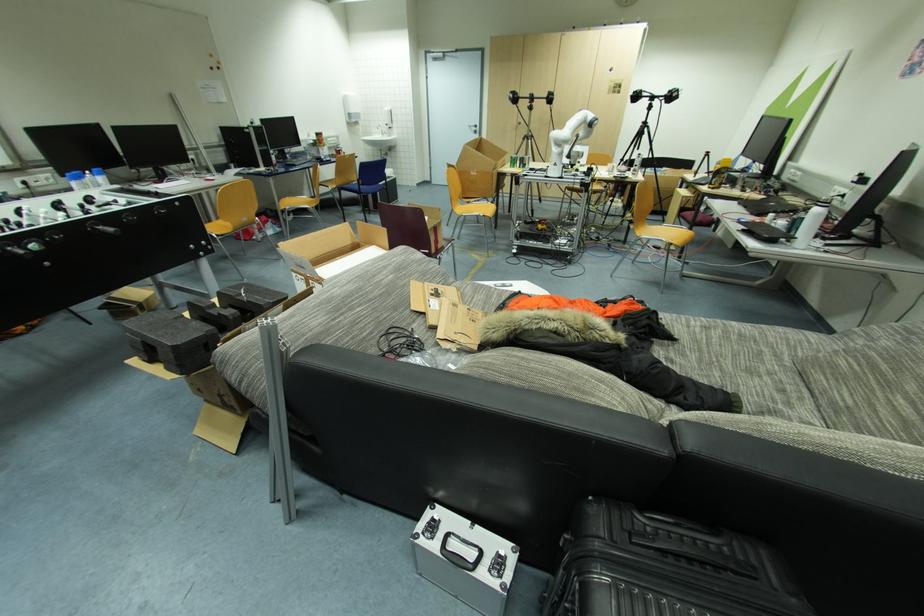
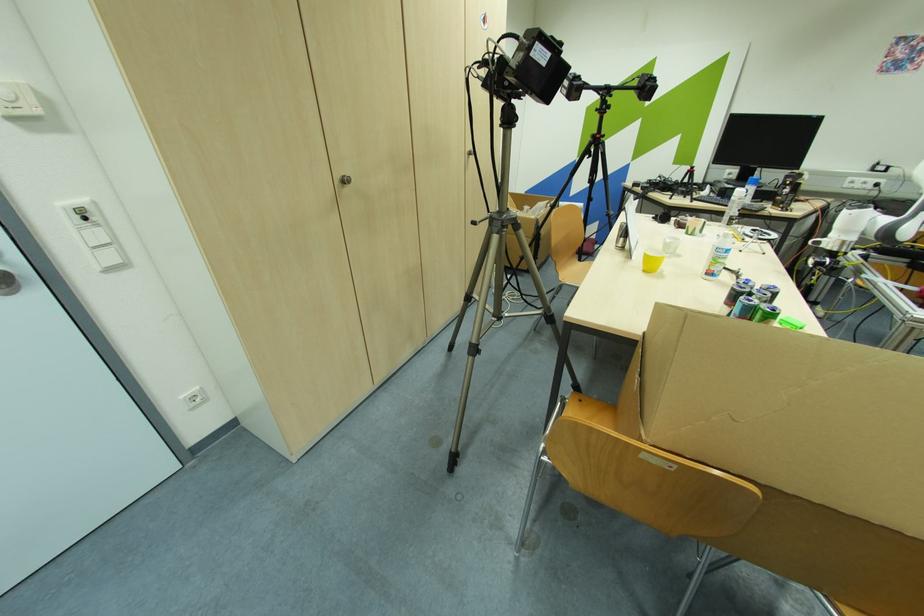
The point at (523, 124) is marked in the first image. Where is the corresponding point in the second image?

(348, 182)